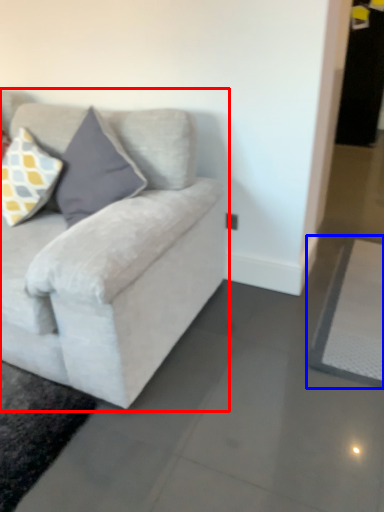
Question: Which point is further to the camera, studio couch (highlighted by a red box) or yoga mat (highlighted by a blue box)?

Choices:
 (A) studio couch
 (B) yoga mat

Answer: (B)